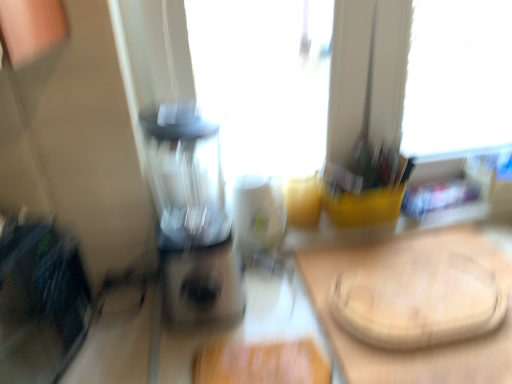
Identify the location of white glossy mug at center. The height and width of the screenshot is (384, 512). (260, 221).

In order to face white glossy mug at center, should I rotate leftwards or rightwards?

Rotate right and turn 0.351 degrees.

This screenshot has width=512, height=384. What do you see at coordinates (192, 218) in the screenshot?
I see `transparent plastic blender at center` at bounding box center [192, 218].

I want to click on white glossy mug at center, so click(x=260, y=221).

Considering the sizes of objects transparent plastic blender at center and wooden cutting board at center in the image provided, who is taller, transparent plastic blender at center or wooden cutting board at center?

transparent plastic blender at center is taller.

Between transparent plastic blender at center and wooden cutting board at center, which one appears on the left side from the viewer's perspective?

From the viewer's perspective, transparent plastic blender at center appears more on the left side.

From a real-world perspective, who is located lower, transparent plastic blender at center or wooden cutting board at center?

wooden cutting board at center.

Is transparent plastic blender at center looking in the opposite direction of wooden cutting board at center?

No, wooden cutting board at center is not at the back of transparent plastic blender at center.

Does white glossy mug at center come in front of transparent plastic blender at center?

No, the depth of white glossy mug at center is greater than that of transparent plastic blender at center.

Is white glossy mug at center placed right next to transparent plastic blender at center?

No, white glossy mug at center is not in contact with transparent plastic blender at center.

Who is taller, white glossy mug at center or transparent plastic blender at center?

transparent plastic blender at center is taller.

Where is `appliance that is behind the transparent plastic blender at center`? appliance that is behind the transparent plastic blender at center is located at coordinates (260, 221).

Where is `appliance above the wooden cutting board at center (from the image's perspective)`? appliance above the wooden cutting board at center (from the image's perspective) is located at coordinates (260, 221).

Does wooden cutting board at center have a greater width compared to white glossy mug at center?

Yes.

From the image's perspective, relative to white glossy mug at center, is wooden cutting board at center above or below?

wooden cutting board at center is below white glossy mug at center.

Is wooden cutting board at center positioned with its back to white glossy mug at center?

That's not correct — wooden cutting board at center is not looking away from white glossy mug at center.

Does white glossy mug at center have a smaller size compared to wooden cutting board at center?

Indeed, white glossy mug at center has a smaller size compared to wooden cutting board at center.

Considering the positions of point (247, 232) and point (501, 272), is point (247, 232) closer or farther from the camera than point (501, 272)?

Point (247, 232) is positioned farther from the camera compared to point (501, 272).

Looking at this image, considering the relative positions of white glossy mug at center and wooden cutting board at center in the image provided, is white glossy mug at center to the left of wooden cutting board at center from the viewer's perspective?

Correct, you'll find white glossy mug at center to the left of wooden cutting board at center.

The image size is (512, 384). Identify the location of counter top in front of the white glossy mug at center. (406, 281).

Does wooden cutting board at center turn towards transparent plastic blender at center?

No, wooden cutting board at center does not turn towards transparent plastic blender at center.

From the picture: From the image's perspective, is wooden cutting board at center on top of transparent plastic blender at center?

No.

This screenshot has height=384, width=512. In order to click on blender on the left side of wooden cutting board at center in this screenshot , I will do [x=192, y=218].

Considering the points (471, 360) and (194, 307), which point is behind, point (471, 360) or point (194, 307)?

The point (194, 307) is farther.

Is transparent plastic blender at center inside or outside of white glossy mug at center?

transparent plastic blender at center lies outside white glossy mug at center.

Is transparent plastic blender at center aimed at white glossy mug at center?

No, transparent plastic blender at center is not aimed at white glossy mug at center.

How different are the orientations of transparent plastic blender at center and white glossy mug at center in degrees?

The angle between the facing direction of transparent plastic blender at center and the facing direction of white glossy mug at center is 0.000138 degrees.

Locate an element on the screen. Image resolution: width=512 pixels, height=384 pixels. blender positioned vertically above the wooden cutting board at center (from a real-world perspective) is located at coordinates (192, 218).

The width and height of the screenshot is (512, 384). What are the coordinates of `blender in front of the white glossy mug at center` in the screenshot? It's located at (192, 218).

Based on their spatial positions, is wooden cutting board at center or transparent plastic blender at center further from white glossy mug at center?

wooden cutting board at center is positioned further to the anchor white glossy mug at center.

Considering their positions, is wooden cutting board at center positioned further to transparent plastic blender at center than white glossy mug at center?

Among the two, wooden cutting board at center is located further to transparent plastic blender at center.

From the image, which object appears to be nearer to wooden cutting board at center, transparent plastic blender at center or white glossy mug at center?

white glossy mug at center.

From the image, which object appears to be nearer to white glossy mug at center, transparent plastic blender at center or wooden cutting board at center?

The object closer to white glossy mug at center is transparent plastic blender at center.

Estimate the real-world distances between objects in this image. Which object is closer to wooden cutting board at center, white glossy mug at center or transparent plastic blender at center?

white glossy mug at center.

Looking at the image, which one is located further to transparent plastic blender at center, white glossy mug at center or wooden cutting board at center?

Based on the image, wooden cutting board at center appears to be further to transparent plastic blender at center.

I want to click on appliance situated between transparent plastic blender at center and wooden cutting board at center from left to right, so click(260, 221).